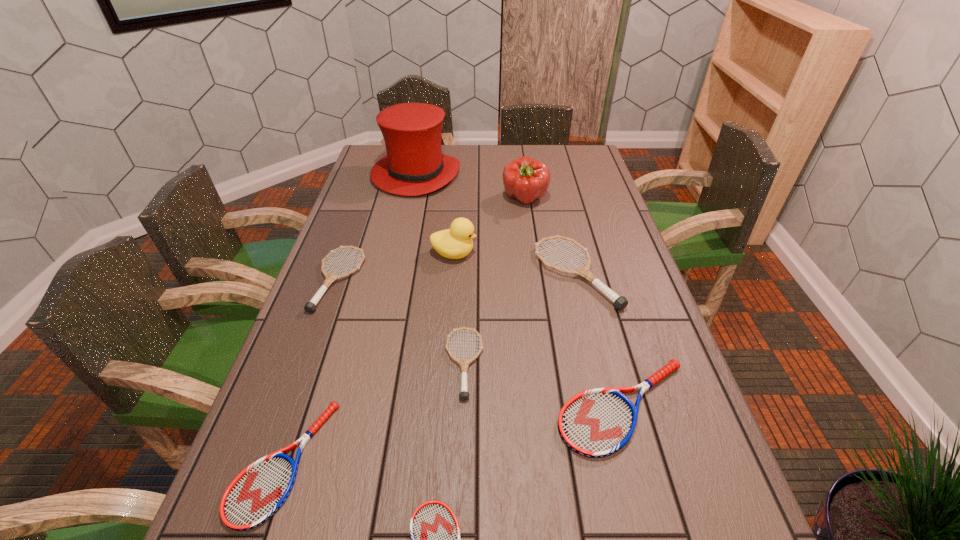
You are a GUI agent. You are given a task and a screenshot of the screen. Output one action in this format:
    pyautogui.click(x=<x>, y=<y>)
    Task: Click on the hat
    This screenshot has width=960, height=540.
    Given the screenshot: What is the action you would take?
    pyautogui.click(x=414, y=165)

Where is `the tallest object`? The width and height of the screenshot is (960, 540). the tallest object is located at coordinates (414, 165).

This screenshot has height=540, width=960. I want to click on the second tallest object, so click(x=525, y=179).

Where is `pepper`? This screenshot has width=960, height=540. pepper is located at coordinates (525, 179).

Locate an element on the screen. The height and width of the screenshot is (540, 960). the third tallest object is located at coordinates (454, 243).

Where is `the sixth shortest object`? This screenshot has height=540, width=960. the sixth shortest object is located at coordinates (620, 302).

Image resolution: width=960 pixels, height=540 pixels. Identify the location of the biggest gray tennis racket. click(620, 302).

Where is `the fifth tallest object`? The image size is (960, 540). the fifth tallest object is located at coordinates click(310, 307).

This screenshot has width=960, height=540. Find the location of `the second tallest tennis racket`. the second tallest tennis racket is located at coordinates (310, 307).

Locate an element on the screen. the nearest gray tennis racket is located at coordinates (464, 363).